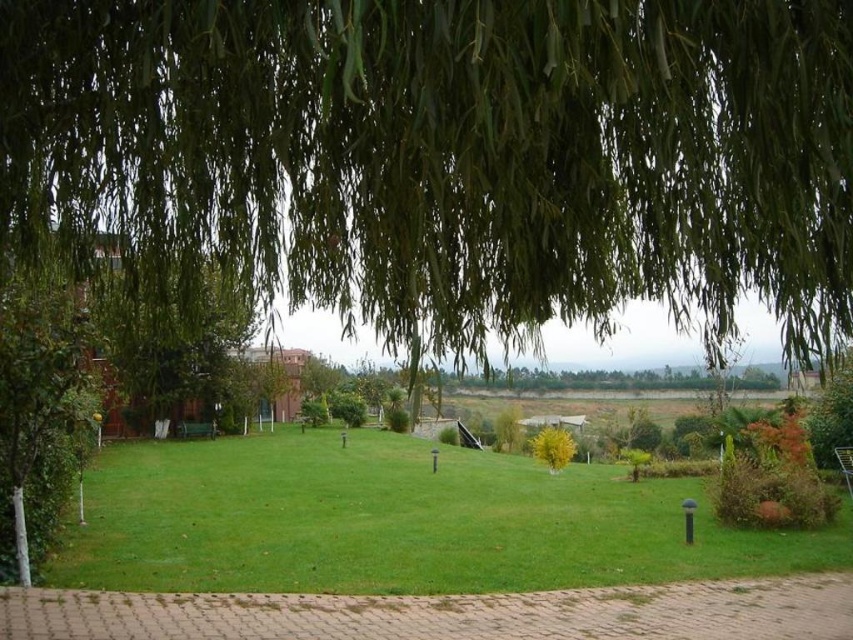
Question: Does green leafy willow at upper center appear on the left side of yellow-green leafy tree at center?

Choices:
 (A) yes
 (B) no

Answer: (A)

Question: Which point is closer to the camera?

Choices:
 (A) (250, 188)
 (B) (566, 440)
 (C) (508, 547)

Answer: (A)

Question: Which point is farther to the camera?

Choices:
 (A) yellow-green leafy tree at center
 (B) green grass at center

Answer: (A)

Question: Is green grass at center bigger than yellow-green leafy tree at center?

Choices:
 (A) yes
 (B) no

Answer: (A)

Question: Is green leafy willow at upper center above green grass at center?

Choices:
 (A) no
 (B) yes

Answer: (B)

Question: Estimate the real-world distances between objects in this image. Which object is closer to the green grass at center?

Choices:
 (A) yellow-green leafy tree at center
 (B) green leafy willow at upper center

Answer: (A)